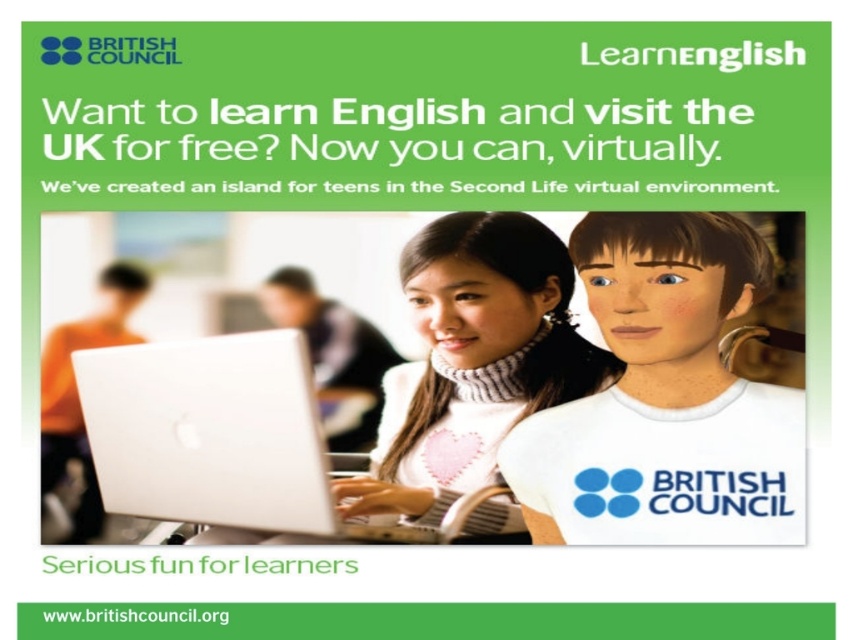
Question: Considering the real-world distances, which object is closest to the white matte laptop at center?

Choices:
 (A) white matte t-shirt at center
 (B) white knitted sweater at center

Answer: (B)

Question: Does white matte laptop at center have a lesser width compared to white knitted sweater at center?

Choices:
 (A) no
 (B) yes

Answer: (A)

Question: Which object is positioned closest to the white matte t-shirt at center?

Choices:
 (A) white knitted sweater at center
 (B) white matte laptop at center

Answer: (A)

Question: Is white matte t-shirt at center smaller than white knitted sweater at center?

Choices:
 (A) yes
 (B) no

Answer: (A)

Question: Among these points, which one is nearest to the camera?

Choices:
 (A) (291, 461)
 (B) (664, 264)

Answer: (A)

Question: Can you confirm if white matte t-shirt at center is positioned to the left of white matte laptop at center?

Choices:
 (A) no
 (B) yes

Answer: (A)